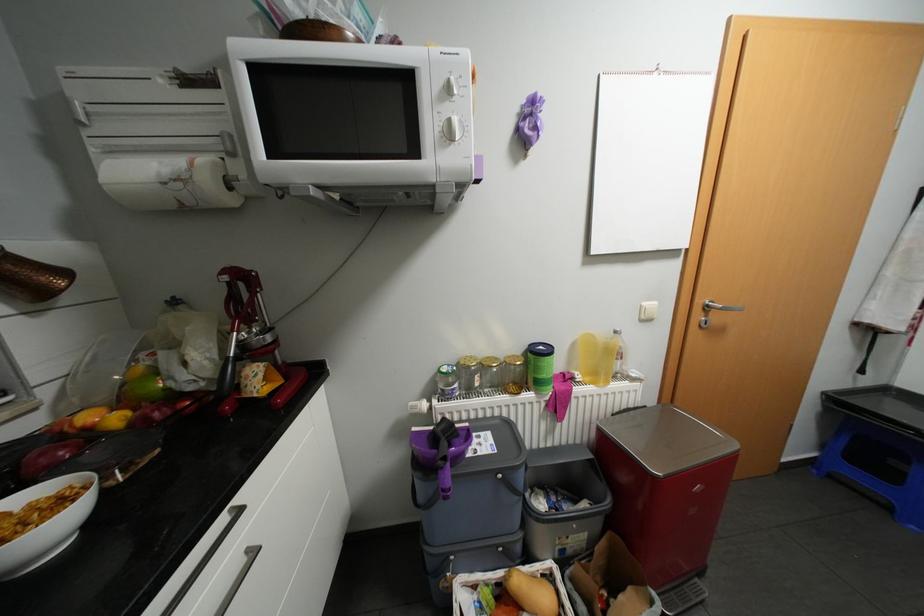
You are a GUI agent. You are given a task and a screenshot of the screen. Output one action in this format:
    pyautogui.click(x=<x>, y=<y>)
    Task: Click on the purple brush handle
    Image resolution: width=924 pixels, height=616 pixels.
    Given the screenshot: What is the action you would take?
    pyautogui.click(x=444, y=480)